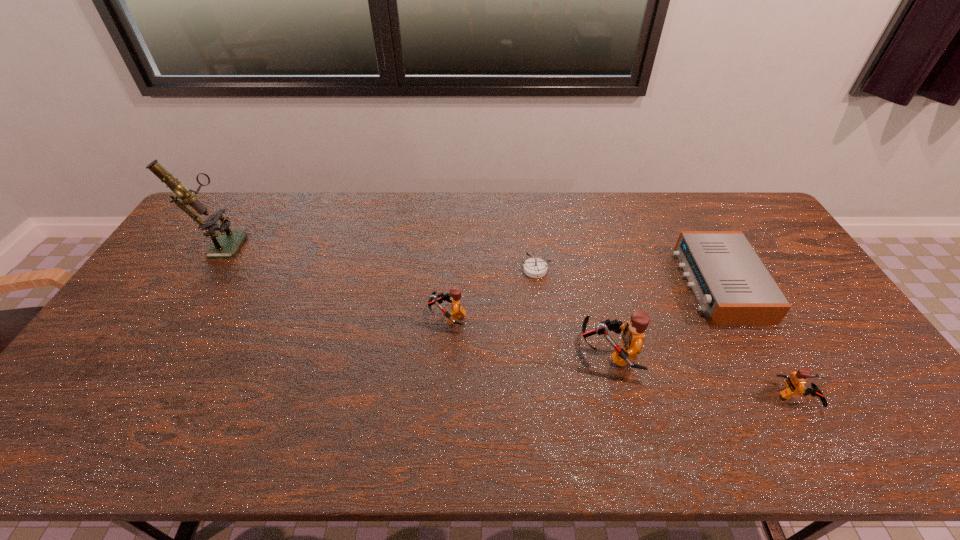
This screenshot has width=960, height=540. Identify the location of free space located on the control panel of the second shortest object. (665, 285).

What are the coordinates of `vacant space situated 0.330m on the control panel of the second shortest object` in the screenshot? It's located at (577, 285).

Find the location of `vacant space situated on the back of the compass`. vacant space situated on the back of the compass is located at coordinates (532, 240).

The image size is (960, 540). In order to click on object located at the far edge in this screenshot , I will do `click(225, 245)`.

The height and width of the screenshot is (540, 960). I want to click on object positioned at the left edge, so click(225, 245).

Locate an element on the screen. The image size is (960, 540). object that is at the far left corner is located at coordinates (225, 245).

Identify the location of free region at the far edge of the desktop. This screenshot has height=540, width=960. (312, 218).

Locate an element on the screen. The height and width of the screenshot is (540, 960). vacant space at the near edge of the desktop is located at coordinates (228, 394).

The height and width of the screenshot is (540, 960). What are the coordinates of `vacant space at the right edge of the desktop` in the screenshot? It's located at (796, 339).

In order to click on vacant space at the far left corner of the desktop in this screenshot , I will do `click(192, 230)`.